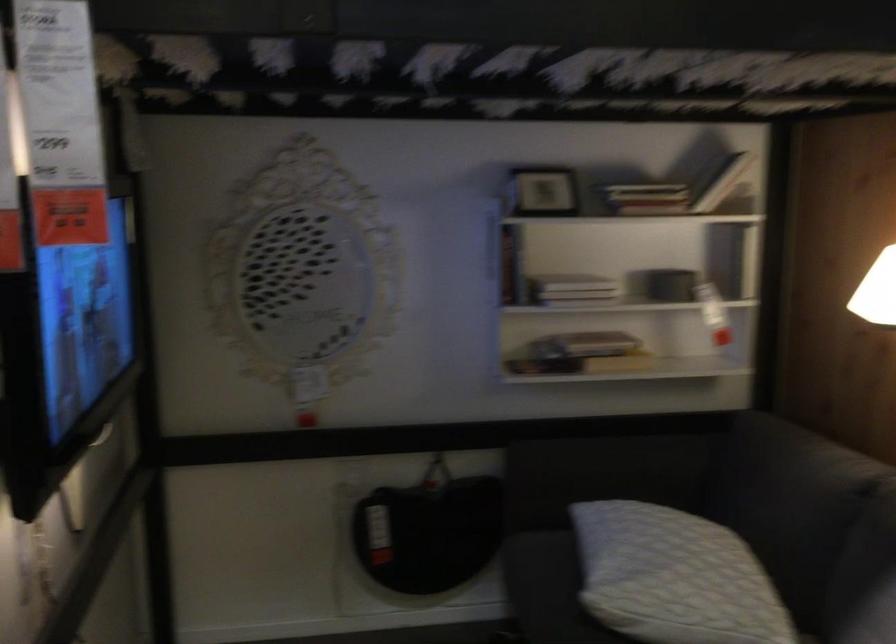
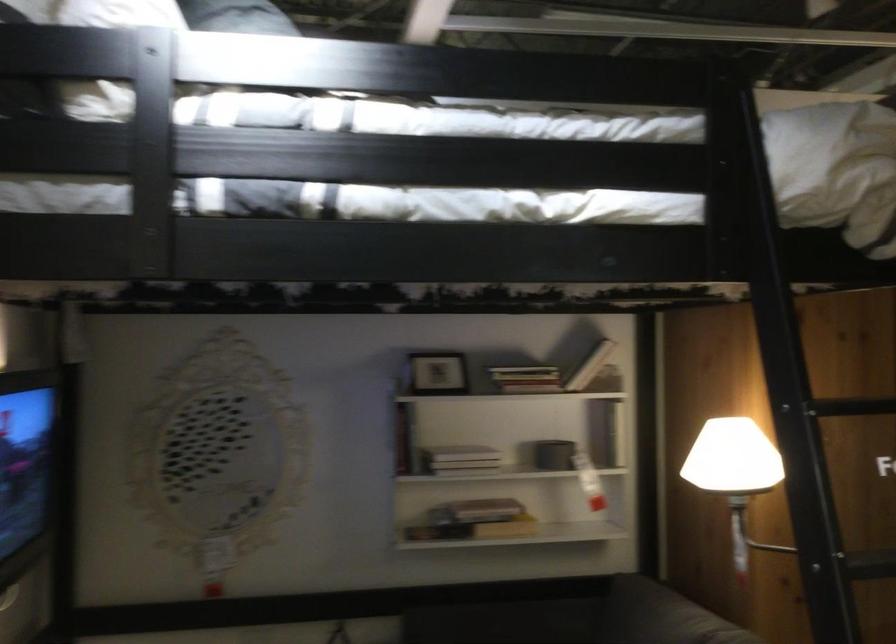
Find the pixel in the second image that matches point 586,361 in the first image.

(474, 529)